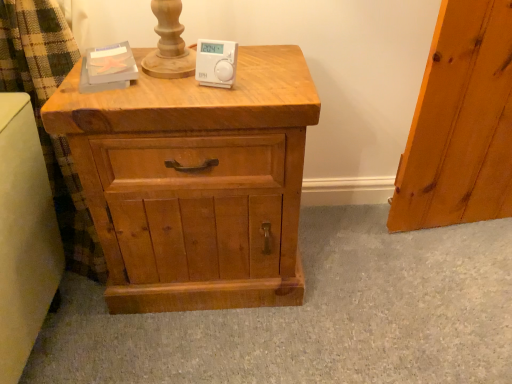
Locate an element on the screen. The image size is (512, 384). free spot in front of natural wood chest of drawers at center is located at coordinates (193, 345).